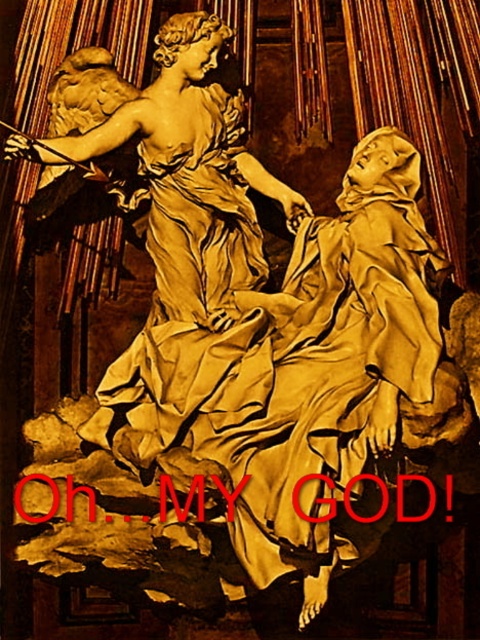
In the scene shown: Is matte gold robe at center smaller than matte gold statue at upper center?

Actually, matte gold robe at center might be larger than matte gold statue at upper center.

Can you confirm if matte gold robe at center is positioned below matte gold statue at upper center?

Yes, matte gold robe at center is below matte gold statue at upper center.

Does point (336, 545) lie in front of point (169, 240)?

Yes.

Find the location of a particular element. matte gold robe at center is located at coordinates (339, 349).